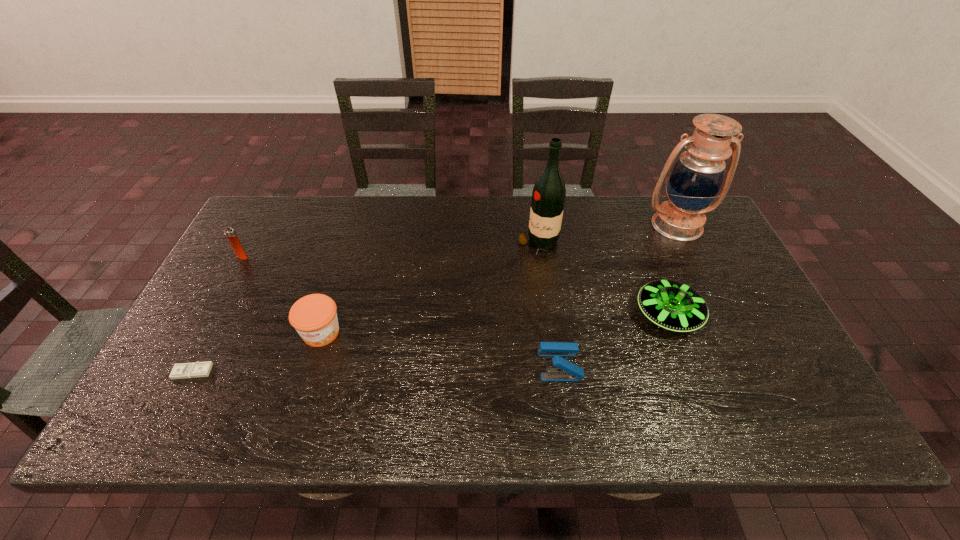
Where is `oil lamp`? oil lamp is located at coordinates (697, 176).

Where is `wine bottle`? The image size is (960, 540). wine bottle is located at coordinates (549, 193).

The width and height of the screenshot is (960, 540). I want to click on igniter, so click(229, 232).

You are a GUI agent. You are given a task and a screenshot of the screen. Output one action in this format:
    pyautogui.click(x=<x>, y=<y>)
    Task: Click on the fifth object from right to left
    Image resolution: width=960 pixels, height=540 pixels.
    Given the screenshot: What is the action you would take?
    pyautogui.click(x=314, y=316)

This screenshot has height=540, width=960. Identify the location of saucer. (672, 305).

Where is `stapler`? The image size is (960, 540). stapler is located at coordinates (567, 371).

What are the coordinates of `money` in the screenshot? It's located at (198, 369).

Identify the location of free space located 0.180m on the front of the oil lamp. Image resolution: width=960 pixels, height=540 pixels. (707, 285).

You are a GUI agent. You are given a task and a screenshot of the screen. Output one action in this format:
    pyautogui.click(x=<x>, y=<y>)
    Task: Click on the vacant region located 0.330m on the right of the wine bottle
    
    Given the screenshot: What is the action you would take?
    pyautogui.click(x=668, y=246)

The height and width of the screenshot is (540, 960). In order to click on free space located 0.400m on the front of the fifth shortest object in this screenshot , I will do `click(175, 380)`.